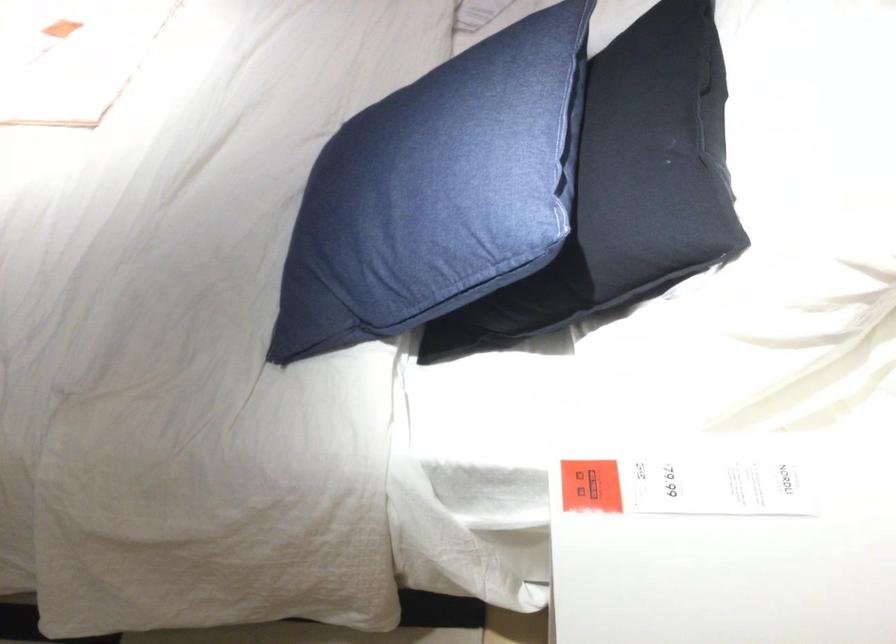
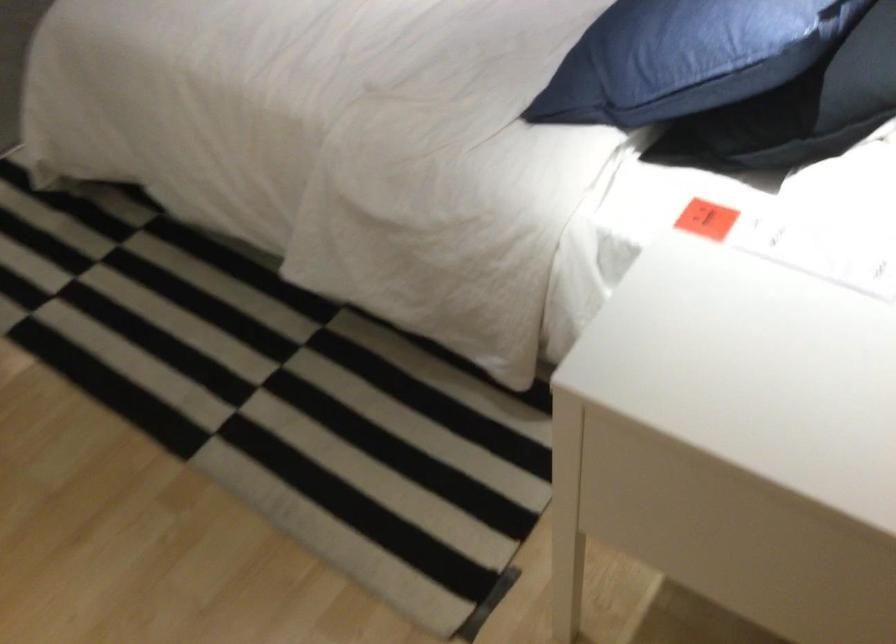
Find the pixel in the second image that matches (x=580, y=279) in the first image.

(808, 108)